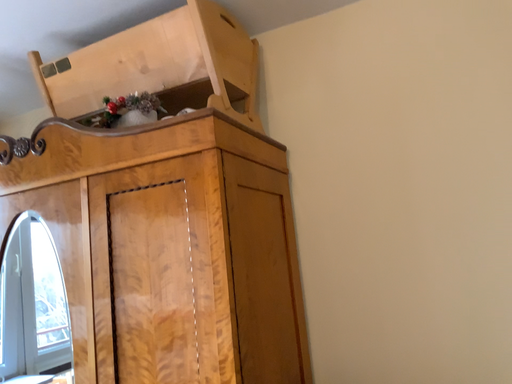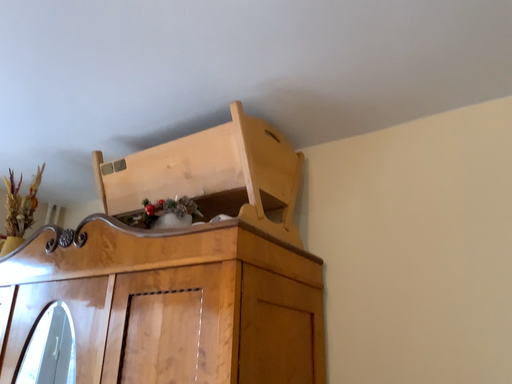
Question: How did the camera likely rotate when shooting the video?

Choices:
 (A) rotated upward
 (B) rotated downward

Answer: (A)